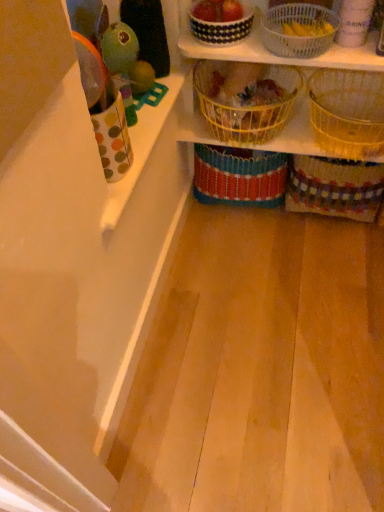
At what (x,y) coordinates should I click in order to perform the action: click on vacant space situated above black and white checkered basket at upper center, the 1th basket viewed from the left (from a real-world perspective). Please return your answer as a coordinate pair (x, y). The image size is (384, 512). Looking at the image, I should click on (221, 9).